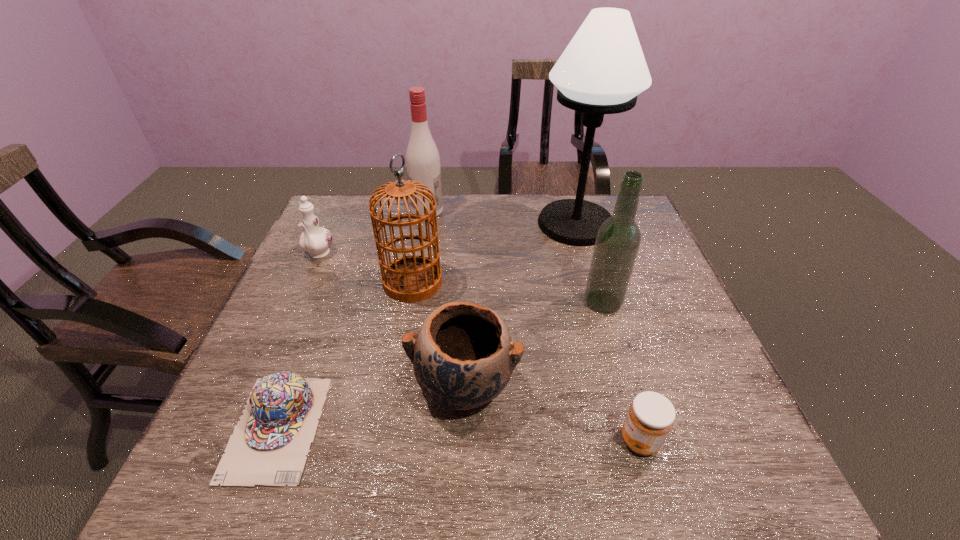
Image resolution: width=960 pixels, height=540 pixels. What are the coordinates of `vacant space positioned 0.220m on the right of the birdcage` in the screenshot? It's located at (524, 282).

At what (x,y) coordinates should I click in order to perform the action: click on free space located on the back of the liquor. Please return your answer as a coordinate pair (x, y). The width and height of the screenshot is (960, 540). Looking at the image, I should click on (576, 213).

This screenshot has height=540, width=960. I want to click on free space located 0.220m at the spout of the chinaware, so click(x=286, y=326).

Locate an element on the screen. This screenshot has width=960, height=540. free space located on the left of the pottery is located at coordinates pos(338,387).

Where is `free space located 0.310m on the front label of the jam`? The image size is (960, 540). free space located 0.310m on the front label of the jam is located at coordinates (458, 441).

Where is `vacant space situated 0.290m on the front label of the jam`? vacant space situated 0.290m on the front label of the jam is located at coordinates (468, 441).

Where is `vacant region located on the front label of the jam`? This screenshot has width=960, height=540. vacant region located on the front label of the jam is located at coordinates (478, 441).

Identify the location of table lamp located at the far edge. The image size is (960, 540). pyautogui.click(x=602, y=70).

This screenshot has height=540, width=960. Identify the location of alcohol positioned at the far edge. (422, 156).

Where is `jam that is positioned at the near edge`? Image resolution: width=960 pixels, height=540 pixels. jam that is positioned at the near edge is located at coordinates (650, 418).